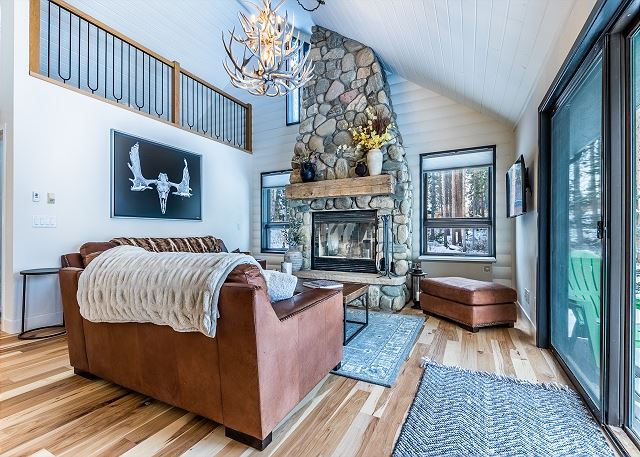
I want to click on glass door, so click(x=576, y=148), click(x=576, y=233), click(x=572, y=312), click(x=592, y=315), click(x=588, y=195).